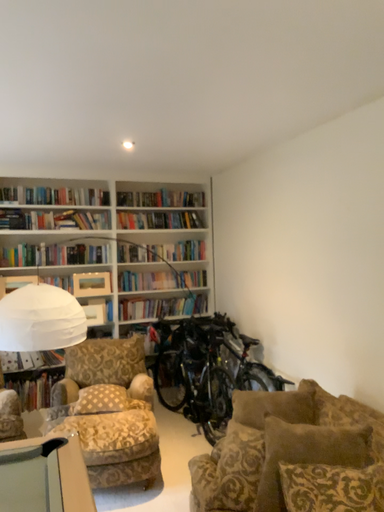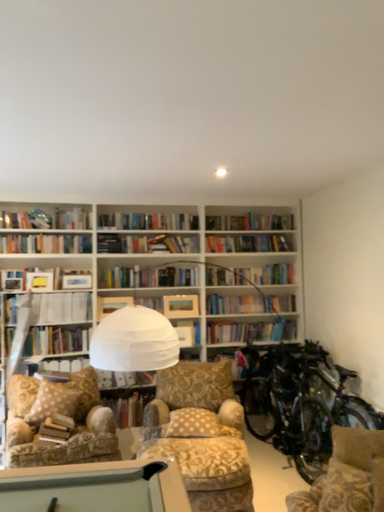
Question: How did the camera likely rotate when shooting the video?

Choices:
 (A) rotated left
 (B) rotated right

Answer: (A)